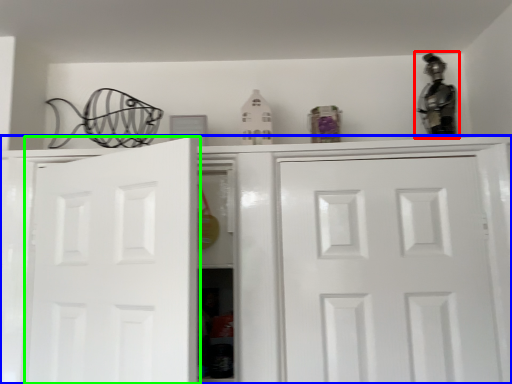
Question: Which object is the farthest from figurine (highlighted by a red box)? Choose among these: cabinetry (highlighted by a blue box) or door (highlighted by a green box).

Choices:
 (A) cabinetry
 (B) door

Answer: (B)